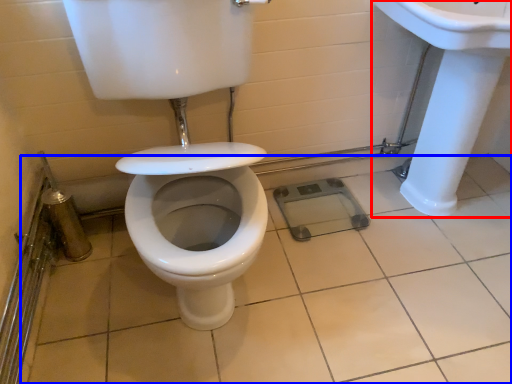
Question: Among these objects, which one is nearest to the camera, sink (highlighted by a red box) or ceramic tile (highlighted by a blue box)?

Choices:
 (A) sink
 (B) ceramic tile

Answer: (B)